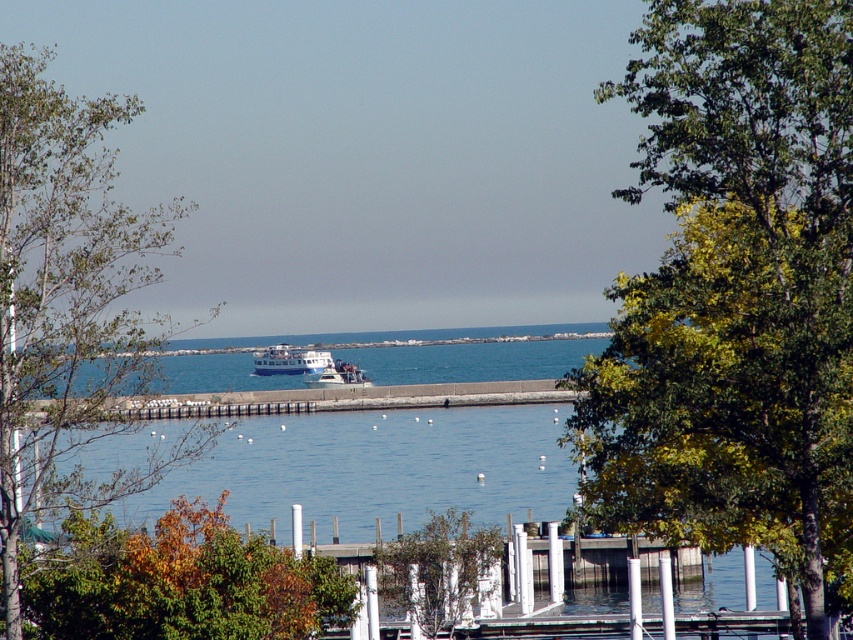
Is point (289, 605) in front of point (276, 346)?

Yes, point (289, 605) is in front of point (276, 346).

Who is taller, green leafy tree at lower left or white glossy boat at center?

Standing taller between the two is white glossy boat at center.

Who is more distant from viewer, (193, 504) or (300, 365)?

The point (300, 365) is behind.

Image resolution: width=853 pixels, height=640 pixels. I want to click on green leafy tree at lower left, so click(178, 582).

Does green leafy tree at center right have a greater width compared to white glossy boat at center?

Incorrect, green leafy tree at center right's width does not surpass white glossy boat at center's.

Which is more to the right, green leafy tree at center right or white glossy boat at center?

Positioned to the right is green leafy tree at center right.

Is point (723, 54) in front of point (299, 362)?

Yes, point (723, 54) is in front of point (299, 362).

What are the coordinates of `green leafy tree at center right` in the screenshot? It's located at (734, 288).

The image size is (853, 640). What do you see at coordinates (67, 310) in the screenshot? I see `green leafy tree at left` at bounding box center [67, 310].

Based on the photo, who is shorter, green leafy tree at left or green leafy tree at center?

green leafy tree at center is shorter.

This screenshot has height=640, width=853. Identify the location of green leafy tree at left. (67, 310).